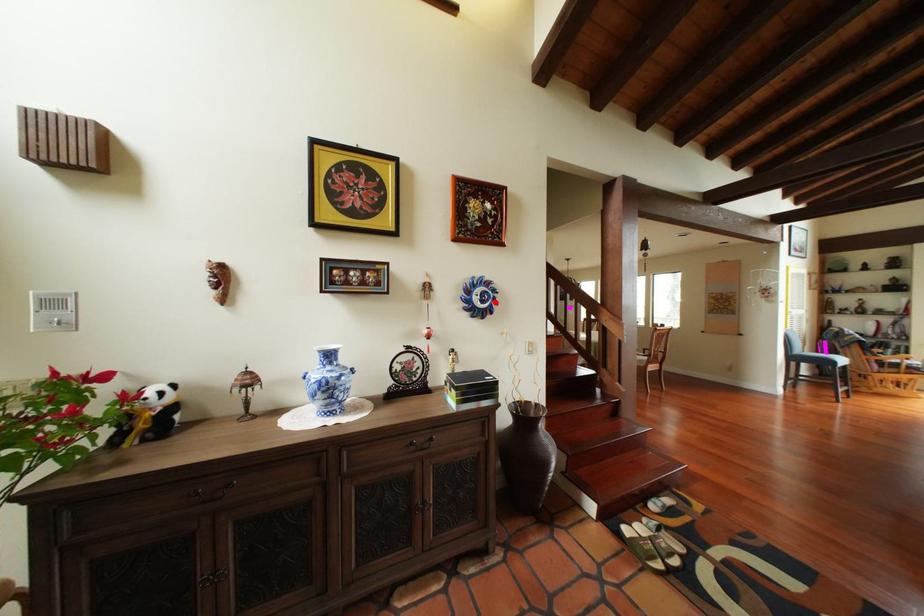
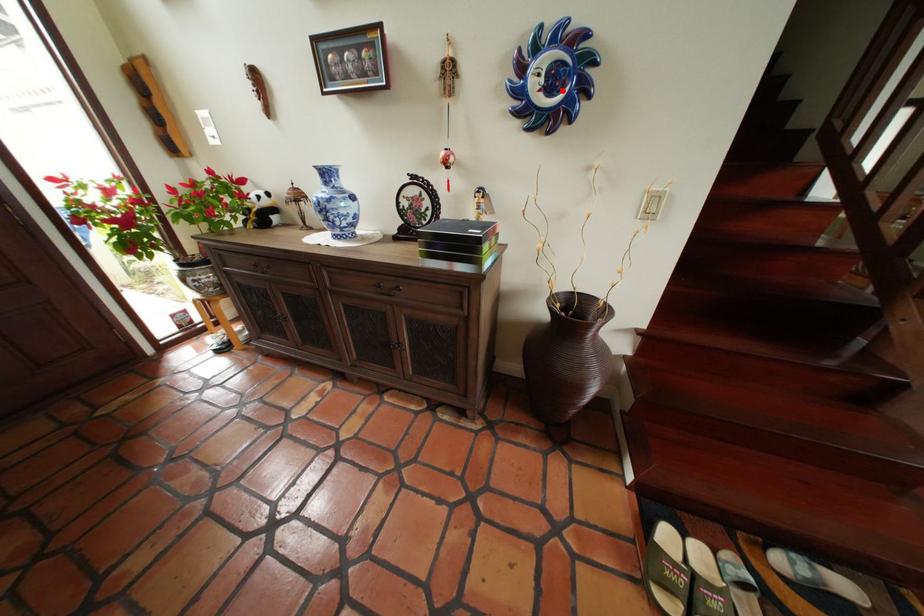
I am providing you with two images of the same scene from different viewpoints. A red point is marked on the first image and another point is marked on the second image. Do the highlighted points in image1 and image2 indicate the same real-world spot?

Yes